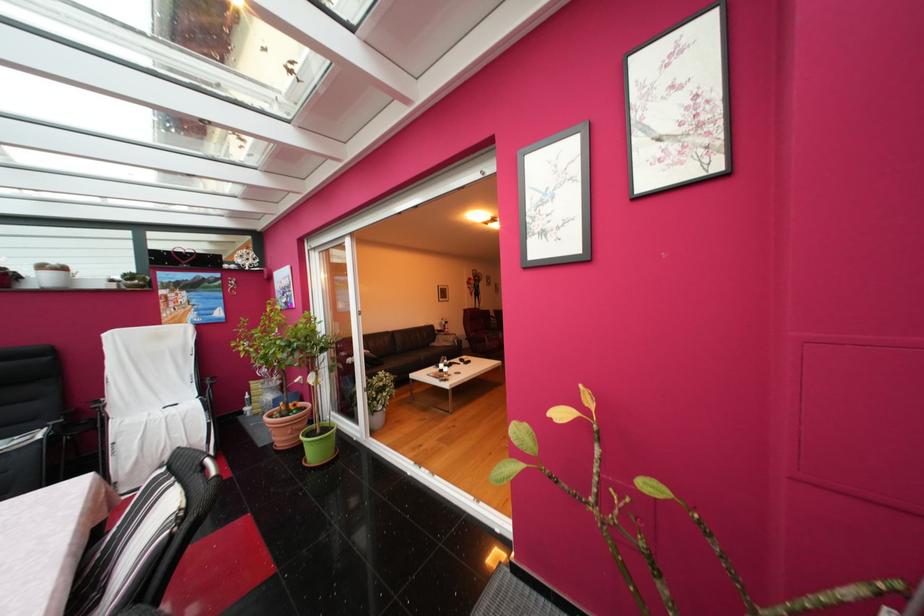
Identify the location of black chair sitting surface. (11, 440).